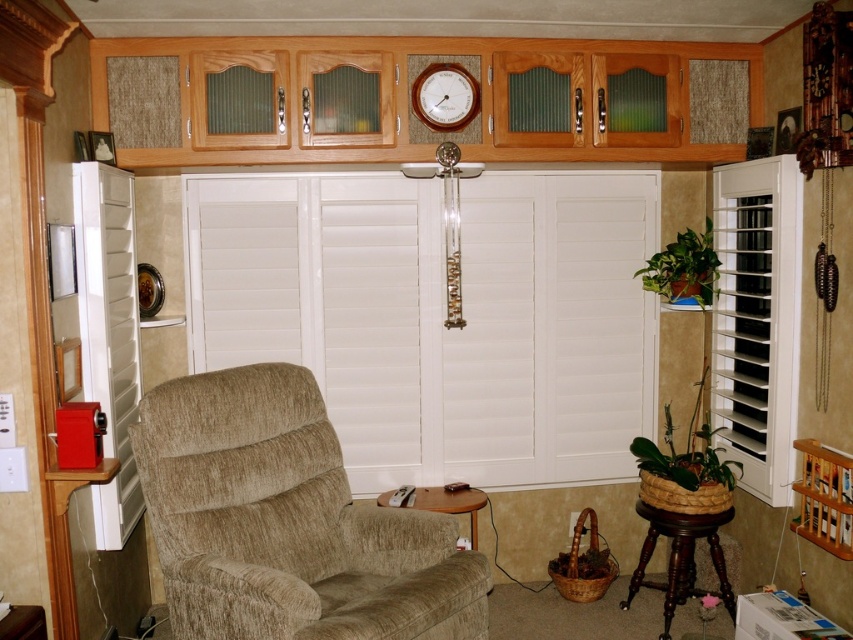
Which is in front, point (640, 381) or point (445, 84)?

Point (445, 84)

Locate an element on the screen. Image resolution: width=853 pixels, height=640 pixels. white wood blinds at center is located at coordinates (440, 316).

Image resolution: width=853 pixels, height=640 pixels. Find the location of `white wood blinds at center`. white wood blinds at center is located at coordinates (440, 316).

Who is more distant from viewer, [790,428] or [474,92]?

Point [474,92]

Is white wood blinds at right further to the viewer compared to matte silver clock at upper center?

No, it is in front of matte silver clock at upper center.

Is point (787, 157) farther from viewer compared to point (438, 70)?

No, it is not.

This screenshot has width=853, height=640. In order to click on white wood blinds at right in this screenshot , I will do `click(757, 320)`.

Between point (349, 225) and point (196, 458), which one is positioned in front?

Point (196, 458)

Can you confirm if white wood blinds at center is positioned below beige chenille armchair at center?

Actually, white wood blinds at center is above beige chenille armchair at center.

Find the location of `white wood blinds at center`. white wood blinds at center is located at coordinates (440, 316).